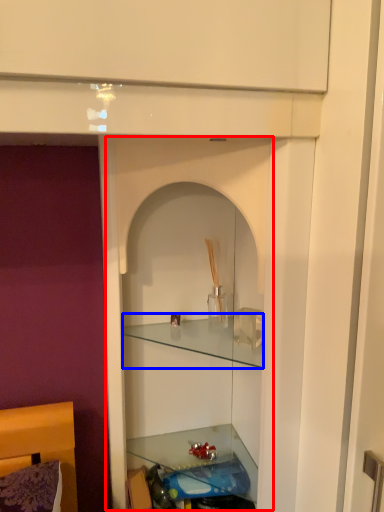
Question: Which object appears farthest to the camera in this image, cabinet (highlighted by a red box) or cabinet (highlighted by a blue box)?

Choices:
 (A) cabinet
 (B) cabinet

Answer: (B)